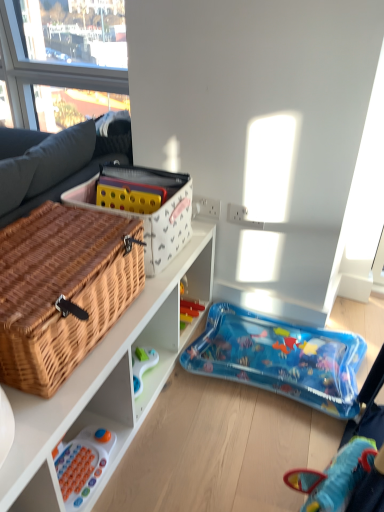
Find the location of `vacant space to the right of white plastic toy at lower left, the 1th toy positioned from the bottom`. vacant space to the right of white plastic toy at lower left, the 1th toy positioned from the bottom is located at coordinates (139, 466).